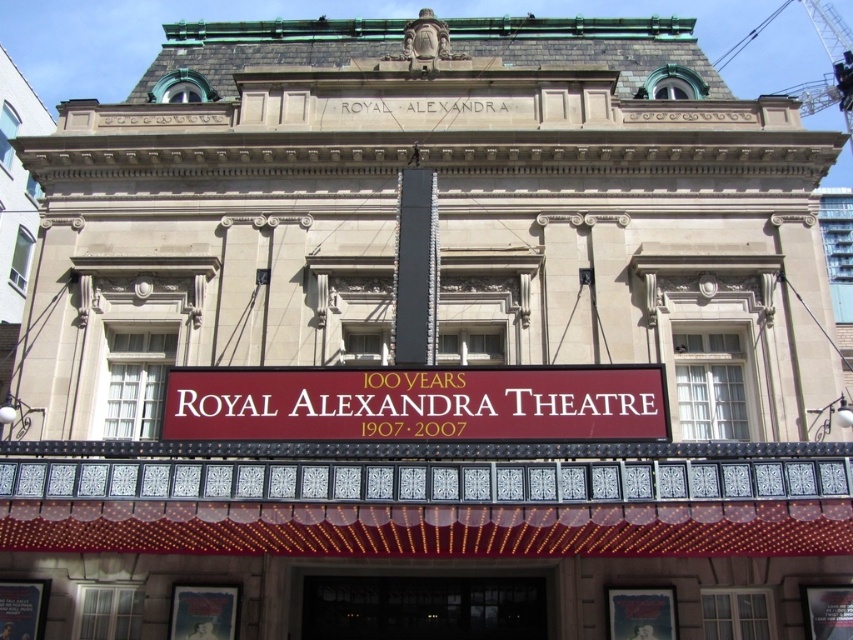
You are a maintenance worker needing to reach the black glass door at center. You have a ladder that is 40 feet long. The maroon sign at center is in your way. Can you safely reach the door without moving the sign?

The maroon sign at center is 47.11 feet away from the black glass door at center. Since the ladder is only 40 feet long, it is not long enough to reach the door from the sign. Therefore, you cannot safely reach the door without moving the sign.

In the scene shown: You are standing in front of the Royal Alexandra Theatre to take a photo. There is a specific point at coordinates point (558, 368) that you want to capture clearly. Considering the distance from your camera to this point, would you need to adjust your focus for a sharp image?

The distance between point (558, 368) and the camera is 116.52 feet. Since this distance is relatively far, you should adjust your camera focus to ensure the point is sharp in the photo.

You are a visitor approaching the Royal Alexandra Theatre and want to enter. You see the maroon sign at center and the black glass door at center. Which object is bigger in size?

The maroon sign at center is larger in size compared to the black glass door at center according to the description.